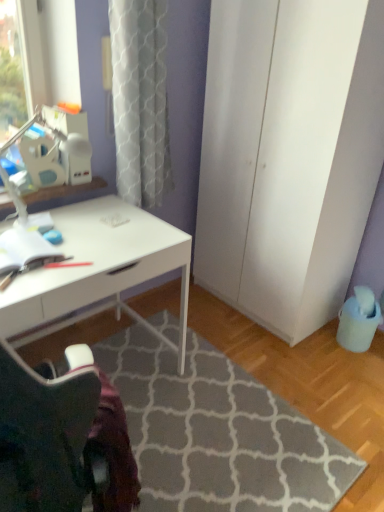
Where is `vacant region to the right of white glossy desk at center`? vacant region to the right of white glossy desk at center is located at coordinates (213, 414).